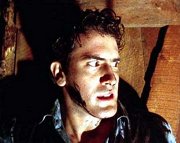
I want to click on shadow on wall, so click(149, 78).